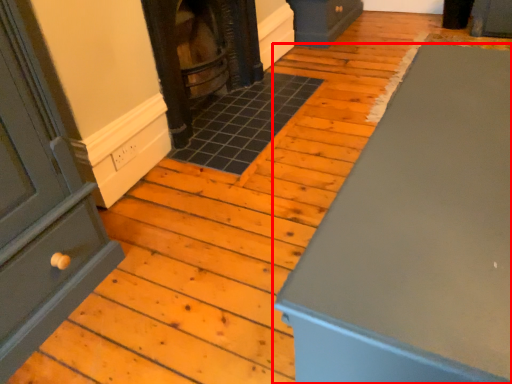
Question: Observing the image, what is the correct spatial positioning of furniture (annotated by the red box) in reference to stove?

Choices:
 (A) right
 (B) left

Answer: (A)